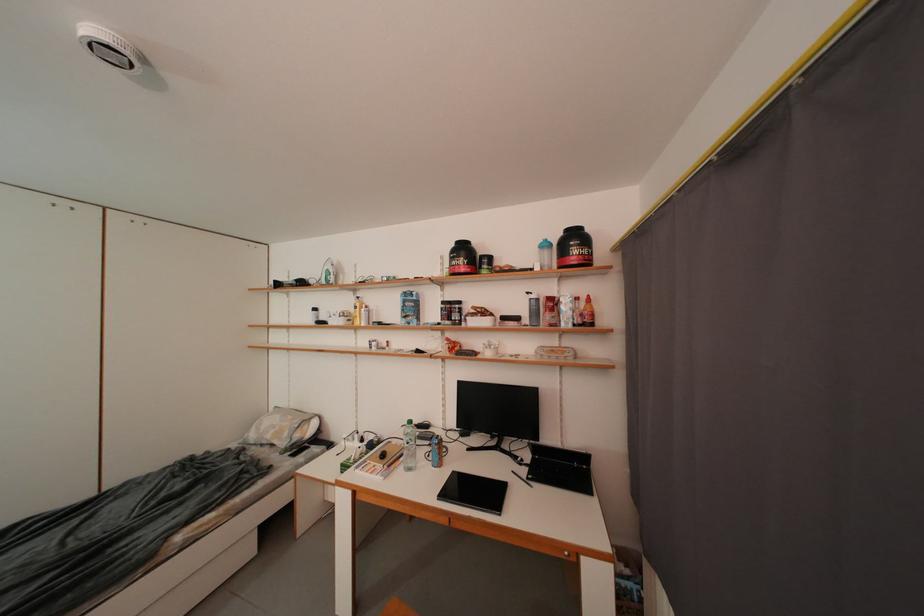
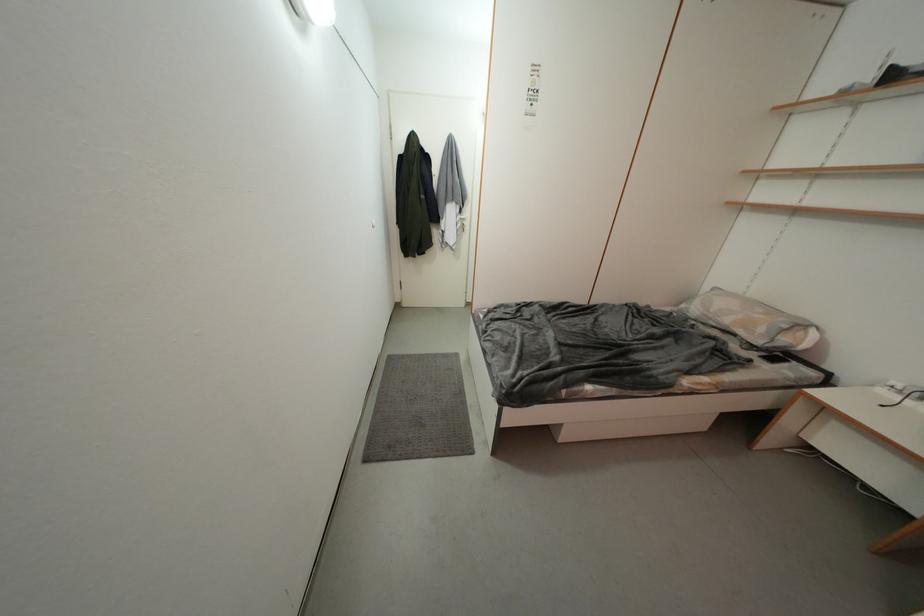
The point at (294,438) is marked in the first image. Where is the corresponding point in the second image?

(769, 333)